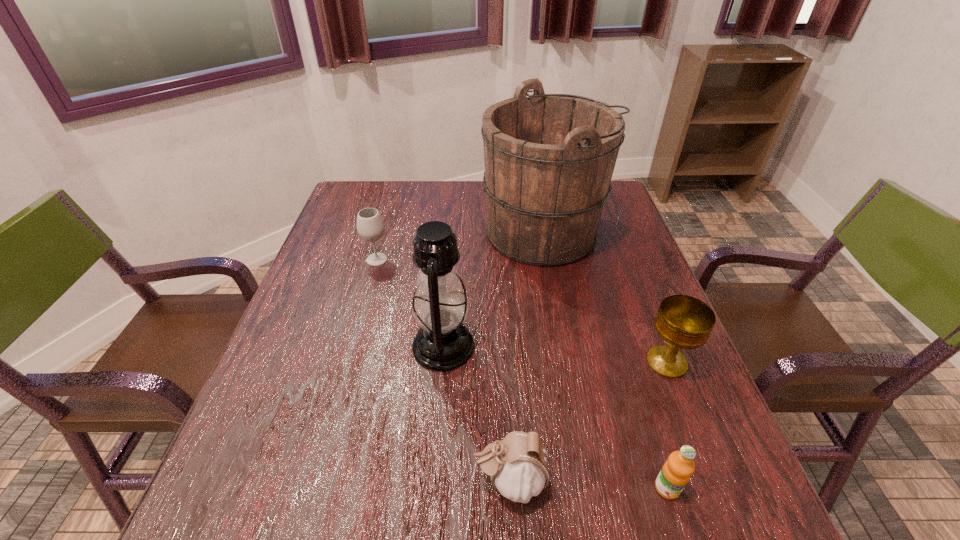
Locate an element on the screen. This screenshot has height=540, width=960. bucket is located at coordinates (549, 158).

I want to click on oil lamp, so coord(443,343).

Locate an element on the screen. The width and height of the screenshot is (960, 540). the second object from left to right is located at coordinates (443, 343).

Locate an element on the screen. This screenshot has width=960, height=540. chalice is located at coordinates (683, 322).

Where is `wineglass`? The width and height of the screenshot is (960, 540). wineglass is located at coordinates (370, 226).

The width and height of the screenshot is (960, 540). Find the location of `pouch`. pouch is located at coordinates (518, 465).

Where is `orange juice`? orange juice is located at coordinates (677, 470).

Where is `free location located on the back of the bucket`? This screenshot has width=960, height=540. free location located on the back of the bucket is located at coordinates (538, 193).

The image size is (960, 540). I want to click on free space located on the left of the fifth object from right to left, so click(x=385, y=347).

Where is `vacant space located 0.400m on the back of the chalice`? The image size is (960, 540). vacant space located 0.400m on the back of the chalice is located at coordinates (617, 238).